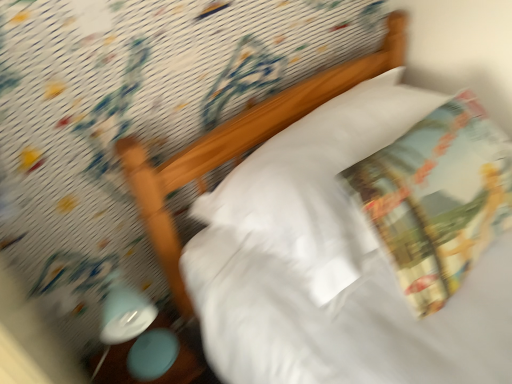
Question: Could you tell me if printed fabric throw pillow at upper right is turned towards matte plastic table at lower left?

Choices:
 (A) yes
 (B) no

Answer: (B)

Question: Can you confirm if printed fabric throw pillow at upper right is bigger than matte plastic table at lower left?

Choices:
 (A) yes
 (B) no

Answer: (A)

Question: Is printed fabric throw pillow at upper right at the left side of matte plastic table at lower left?

Choices:
 (A) yes
 (B) no

Answer: (B)

Question: Are printed fabric throw pillow at upper right and matte plastic table at lower left beside each other?

Choices:
 (A) yes
 (B) no

Answer: (B)

Question: Does printed fabric throw pillow at upper right appear on the right side of matte plastic table at lower left?

Choices:
 (A) yes
 (B) no

Answer: (A)

Question: Is printed fabric throw pillow at upper right looking in the opposite direction of matte plastic table at lower left?

Choices:
 (A) no
 (B) yes

Answer: (A)

Question: Does white soft pillow at upper center turn towards printed fabric throw pillow at upper right?

Choices:
 (A) no
 (B) yes

Answer: (B)

Question: From the image's perspective, is white soft pillow at upper center above printed fabric throw pillow at upper right?

Choices:
 (A) yes
 (B) no

Answer: (A)

Question: Is white soft pillow at upper center to the left of printed fabric throw pillow at upper right from the viewer's perspective?

Choices:
 (A) yes
 (B) no

Answer: (A)

Question: Is white soft pillow at upper center at the right side of printed fabric throw pillow at upper right?

Choices:
 (A) yes
 (B) no

Answer: (B)

Question: Can you confirm if white soft pillow at upper center is smaller than printed fabric throw pillow at upper right?

Choices:
 (A) no
 (B) yes

Answer: (A)

Question: Considering the relative positions of white soft pillow at upper center and printed fabric throw pillow at upper right in the image provided, is white soft pillow at upper center behind printed fabric throw pillow at upper right?

Choices:
 (A) no
 (B) yes

Answer: (B)

Question: Does matte blue lamp at lower left have a greater height compared to printed fabric throw pillow at upper right?

Choices:
 (A) yes
 (B) no

Answer: (A)